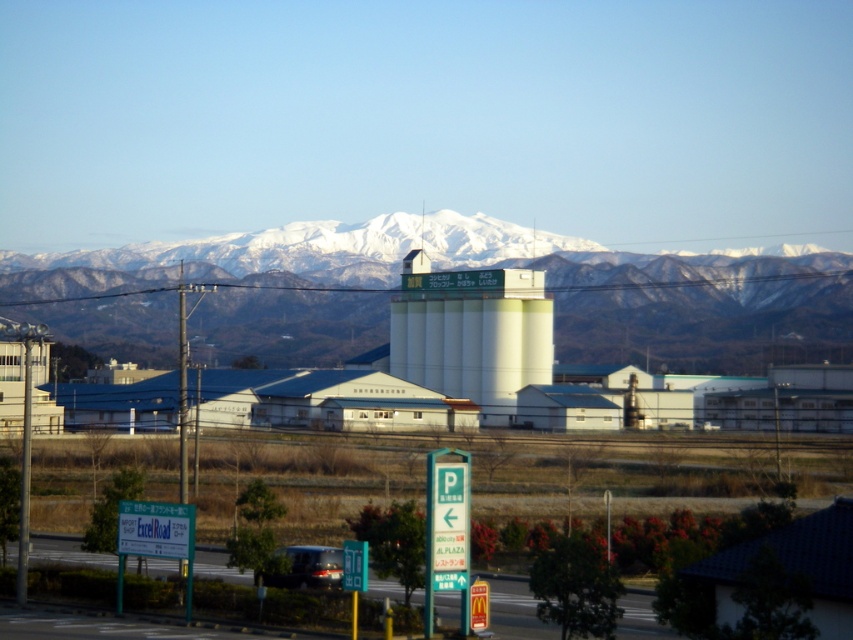
You are standing at the point marked by the coordinates (473, 333) in the image. Based on the scene described, what object are you standing on?

The point marked by the coordinates (473, 333) is on the white matte water tower at center.